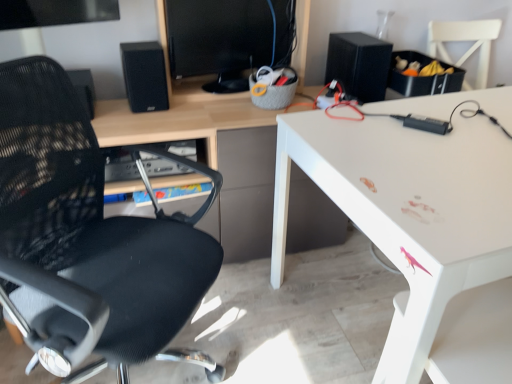
Question: Does white glossy desk at upper right contain black matte speaker at upper left, marked as the second speaker in a right-to-left arrangement?

Choices:
 (A) yes
 (B) no

Answer: (B)

Question: Is white glossy desk at upper right shorter than black matte speaker at upper left, marked as the second speaker in a right-to-left arrangement?

Choices:
 (A) no
 (B) yes

Answer: (A)

Question: Does white glossy desk at upper right have a smaller size compared to black matte speaker at upper left, marked as the second speaker in a right-to-left arrangement?

Choices:
 (A) yes
 (B) no

Answer: (B)

Question: Is white glossy desk at upper right at the right side of black matte speaker at upper left, the 1th speaker positioned from the left?

Choices:
 (A) yes
 (B) no

Answer: (A)

Question: Considering the relative sizes of white glossy desk at upper right and black matte speaker at upper left, marked as the second speaker in a right-to-left arrangement, in the image provided, is white glossy desk at upper right thinner than black matte speaker at upper left, marked as the second speaker in a right-to-left arrangement,?

Choices:
 (A) yes
 (B) no

Answer: (B)

Question: Could you tell me if white glossy desk at upper right is facing black matte speaker at upper left, the 1th speaker positioned from the left?

Choices:
 (A) yes
 (B) no

Answer: (B)

Question: Is white glossy desk at upper right positioned far away from black matte speaker at upper right, the 1th speaker when ordered from right to left?

Choices:
 (A) yes
 (B) no

Answer: (B)

Question: Is white glossy desk at upper right closer to camera compared to black matte speaker at upper right, the 1th speaker when ordered from right to left?

Choices:
 (A) no
 (B) yes

Answer: (B)

Question: From the image's perspective, is white glossy desk at upper right over black matte speaker at upper right, the second speaker from the left?

Choices:
 (A) yes
 (B) no

Answer: (B)

Question: Can you confirm if white glossy desk at upper right is wider than black matte speaker at upper right, the second speaker from the left?

Choices:
 (A) yes
 (B) no

Answer: (A)

Question: Can you confirm if white glossy desk at upper right is positioned to the right of black matte speaker at upper right, the 1th speaker when ordered from right to left?

Choices:
 (A) no
 (B) yes

Answer: (B)

Question: Does white glossy desk at upper right have a lesser width compared to black matte speaker at upper right, the 1th speaker when ordered from right to left?

Choices:
 (A) no
 (B) yes

Answer: (A)

Question: Is black matte speaker at upper left, marked as the second speaker in a right-to-left arrangement, at the right side of black mesh chair at left?

Choices:
 (A) yes
 (B) no

Answer: (B)